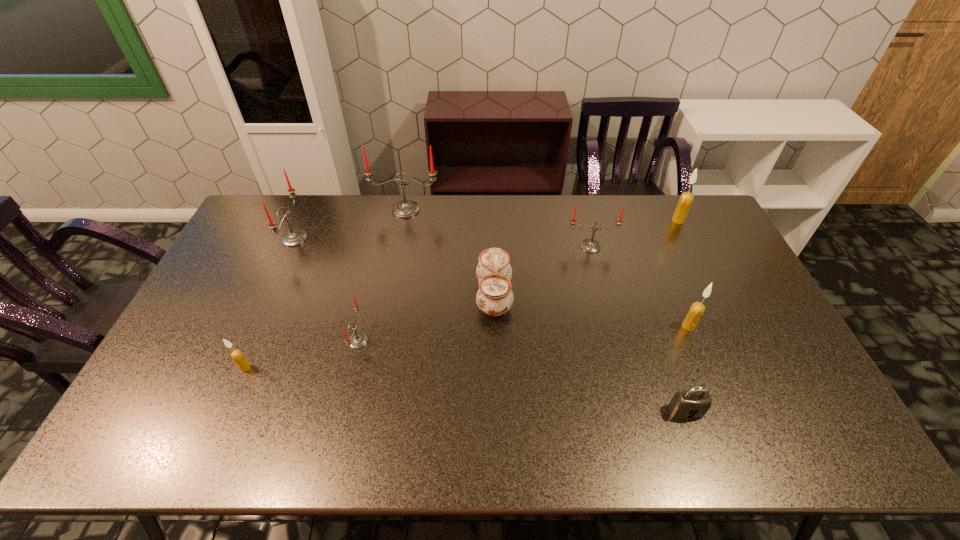
Where is `object that is at the far right corner`? object that is at the far right corner is located at coordinates (686, 198).

This screenshot has height=540, width=960. Identify the location of free space at the far edge. (319, 221).

Find the location of `vacant space at the left edge of the desktop`. vacant space at the left edge of the desktop is located at coordinates (157, 416).

Find the location of a particular element. blank space at the right edge of the desktop is located at coordinates (732, 258).

This screenshot has width=960, height=540. In order to click on vacant region at the far right corner of the desktop in this screenshot , I will do `click(698, 216)`.

Locate an element on the screen. Image resolution: width=960 pixels, height=540 pixels. free space between the second biggest red candle and the white chinaware is located at coordinates (395, 267).

The image size is (960, 540). What are the coordinates of `vacant area between the shortest object and the rightmost candle` in the screenshot? It's located at (682, 315).

The height and width of the screenshot is (540, 960). I want to click on vacant region between the rightmost cream candle and the biggest red candle, so coord(541,215).

Where is `vacant space that is in between the second cream candle from left to right and the biggest red candle`? vacant space that is in between the second cream candle from left to right and the biggest red candle is located at coordinates (547, 268).

Locate an element on the screen. The height and width of the screenshot is (540, 960). vacant area between the biggest red candle and the nearest red candle is located at coordinates (x=382, y=275).